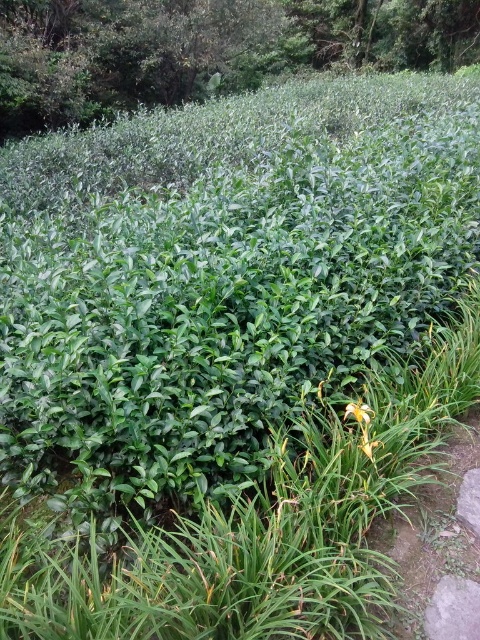
Question: Is green leafy bush at upper center thinner than yellow matte flower at lower right?

Choices:
 (A) yes
 (B) no

Answer: (B)

Question: Does green leafy bush at upper center have a larger size compared to yellow matte flower at lower right?

Choices:
 (A) no
 (B) yes

Answer: (B)

Question: Does green leafy bush at upper center appear on the left side of yellow matte flower at lower center?

Choices:
 (A) no
 (B) yes

Answer: (B)

Question: Based on their relative distances, which object is nearer to the yellow matte flower at lower right?

Choices:
 (A) yellow matte flower at lower center
 (B) green leafy bush at upper center

Answer: (A)

Question: Which object appears closest to the camera in this image?

Choices:
 (A) green leafy bush at upper center
 (B) yellow matte flower at lower center

Answer: (B)

Question: Among these objects, which one is farthest from the camera?

Choices:
 (A) green leafy bush at upper center
 (B) yellow matte flower at lower right
 (C) yellow matte flower at lower center

Answer: (A)